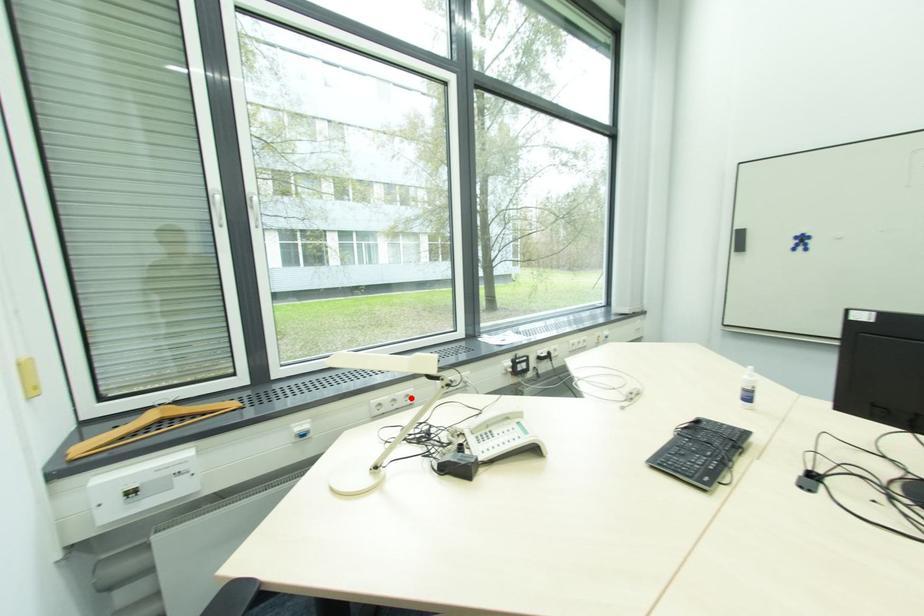
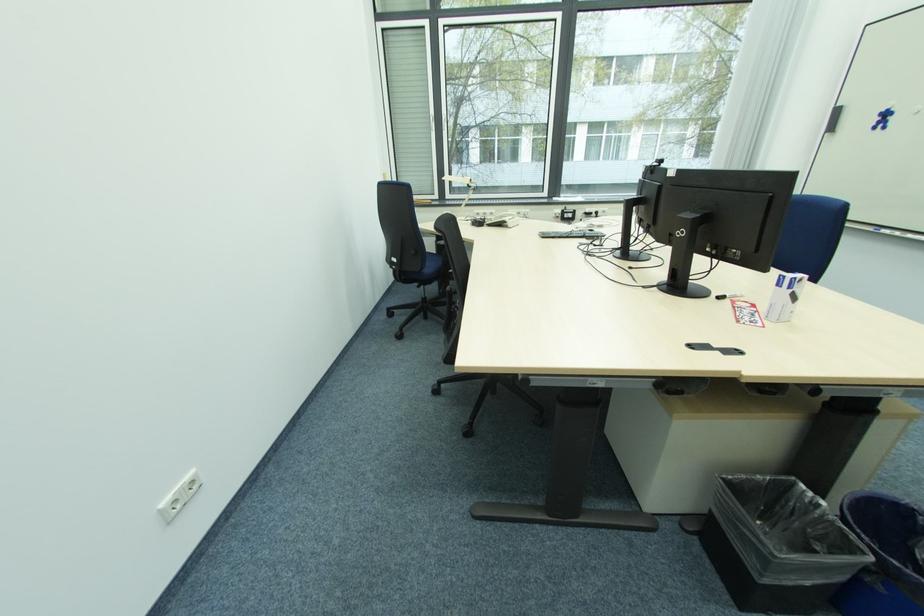
Question: I am providing you with two images of the same scene from different viewpoints. Image1 has a red point marked. In image2, the corresponding 3D location appears at what relative position? Reply with the corresponding letter.

Choices:
 (A) Closer
 (B) Farther

Answer: (A)